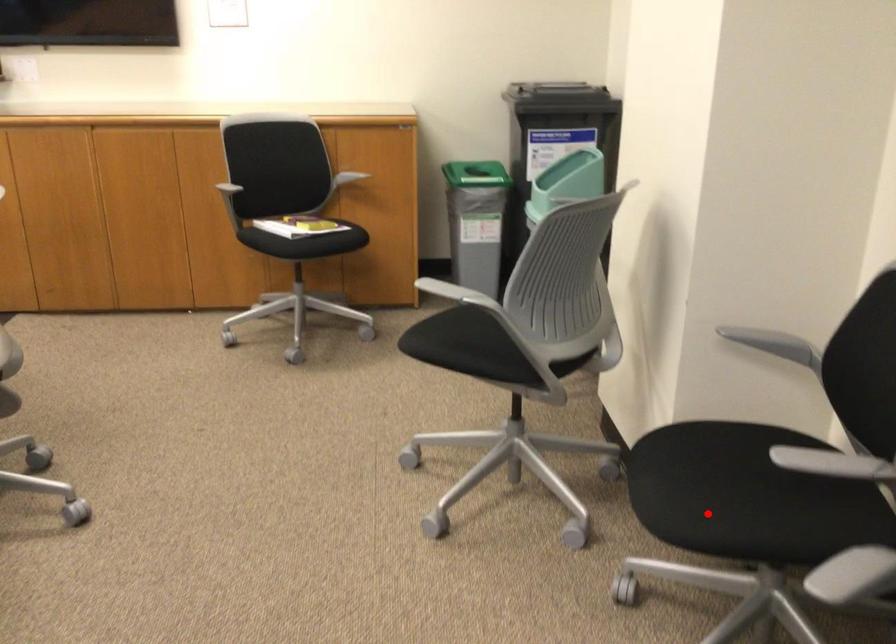
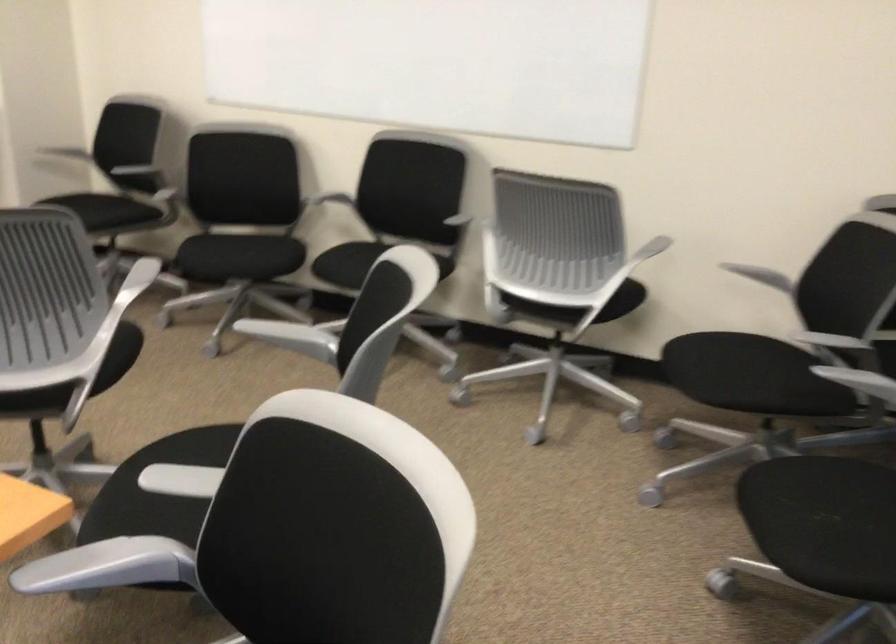
Question: I am providing you with two images of the same scene from different viewpoints. In image1, a red point is highlighted. Considering the same 3D point in image2, which of the following is correct?

Choices:
 (A) It is closer
 (B) It is farther

Answer: (B)